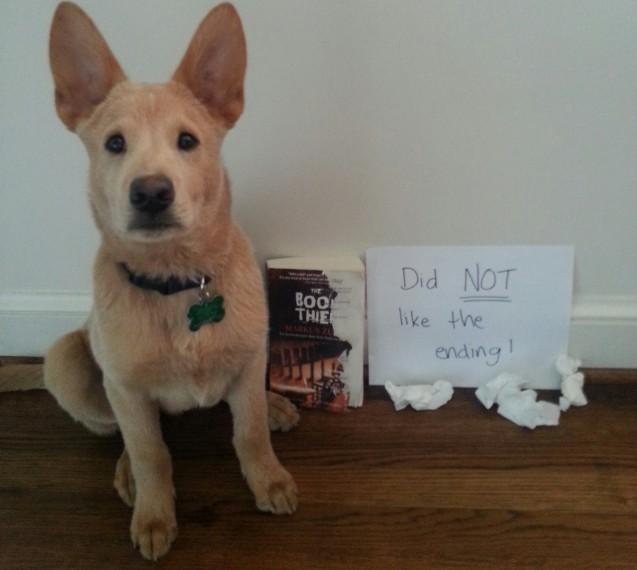
Identify the location of floor. This screenshot has width=637, height=570. (430, 506).